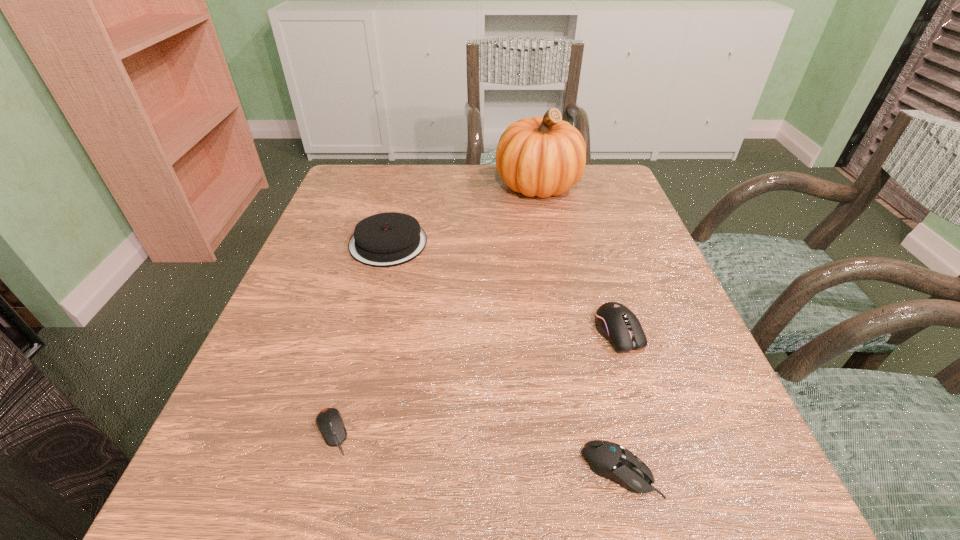
The image size is (960, 540). In order to click on vacant space located on the back of the third farthest object in this screenshot , I will do `click(593, 251)`.

You are a GUI agent. You are given a task and a screenshot of the screen. Output one action in this format:
    pyautogui.click(x=<x>, y=<y>)
    Task: Click on the free region located 0.100m on the left of the second shortest computer mouse
    This screenshot has height=540, width=960.
    Given the screenshot: What is the action you would take?
    pyautogui.click(x=510, y=471)

Identify the location of vacant area situated 0.180m on the right of the leftmost computer mouse. This screenshot has height=540, width=960. coord(475,432).

Locate an element on the screen. object that is at the far edge is located at coordinates (540, 156).

Locate an element on the screen. The image size is (960, 540). object that is at the near edge is located at coordinates (609, 460).

Locate an element on the screen. pancake at the left edge is located at coordinates (390, 239).

Identify the location of computer mouse located at the left edge. (329, 421).

What are the coordinates of `pumpkin at the right edge` in the screenshot? It's located at (540, 156).

This screenshot has width=960, height=540. Find the location of `object present at the far right corner`. object present at the far right corner is located at coordinates (540, 156).

Identify the location of object present at the near right corner. (609, 460).